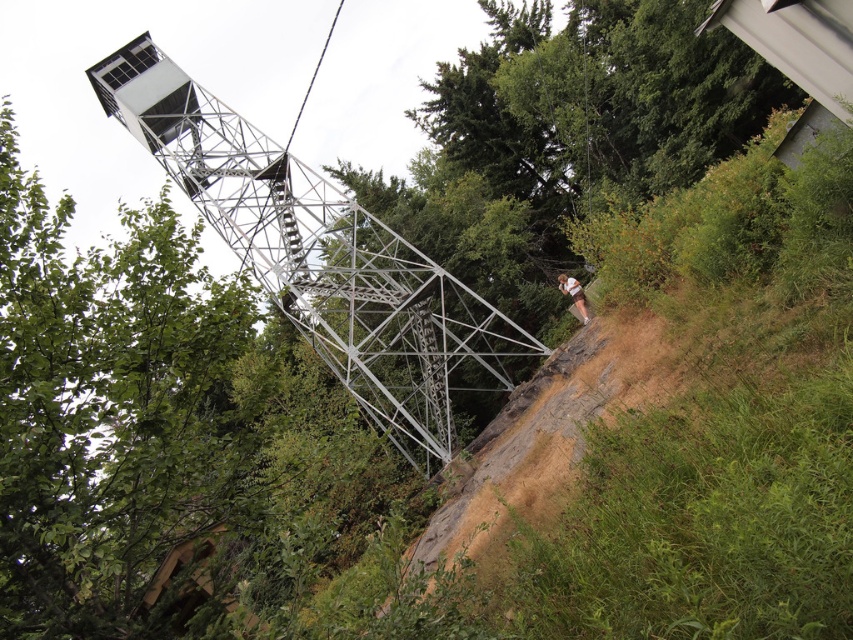
Question: Which point is farther from the camera taking this photo?

Choices:
 (A) pos(561,276)
 (B) pos(415,262)
 (C) pos(532,500)

Answer: (B)

Question: In this image, where is metallic silver tower at upper left located relative to brown dirt track at center-right?

Choices:
 (A) above
 (B) below

Answer: (A)

Question: Which object is closer to the camera taking this photo?

Choices:
 (A) brown leather pants at lower right
 (B) brown dirt track at center-right

Answer: (B)

Question: Does brown dirt track at center-right appear over brown leather pants at lower right?

Choices:
 (A) no
 (B) yes

Answer: (A)

Question: Does metallic silver tower at upper left have a larger size compared to brown dirt track at center-right?

Choices:
 (A) no
 (B) yes

Answer: (B)

Question: Which point is farther to the camera?

Choices:
 (A) brown dirt track at center-right
 (B) metallic silver tower at upper left
 (C) brown leather pants at lower right

Answer: (C)